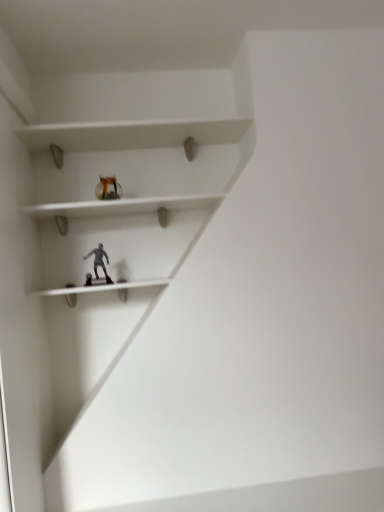
Question: Visually, is translucent glass vase at upper center positioned to the left or to the right of satin silver figurine at center?

Choices:
 (A) left
 (B) right

Answer: (B)

Question: Is translucent glass vase at upper center wider or thinner than satin silver figurine at center?

Choices:
 (A) wide
 (B) thin

Answer: (B)

Question: Do you think translucent glass vase at upper center is within satin silver figurine at center, or outside of it?

Choices:
 (A) outside
 (B) inside

Answer: (A)

Question: Looking at the image, does satin silver figurine at center seem bigger or smaller compared to translucent glass vase at upper center?

Choices:
 (A) small
 (B) big

Answer: (B)

Question: Considering the relative positions of satin silver figurine at center and translucent glass vase at upper center in the image provided, is satin silver figurine at center to the left or to the right of translucent glass vase at upper center?

Choices:
 (A) left
 (B) right

Answer: (A)

Question: Is point (69, 291) closer or farther from the camera than point (104, 183)?

Choices:
 (A) closer
 (B) farther

Answer: (B)

Question: From the image's perspective, relative to translucent glass vase at upper center, is satin silver figurine at center above or below?

Choices:
 (A) above
 (B) below

Answer: (B)